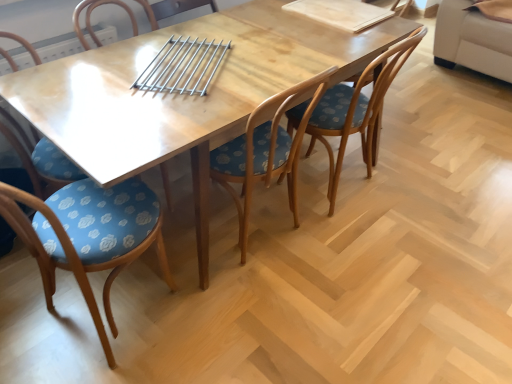
What are the coordinates of `free location to the right of wooden chair with floral cushion at center, acting as the 1th chair starting from the right` in the screenshot? It's located at (418, 188).